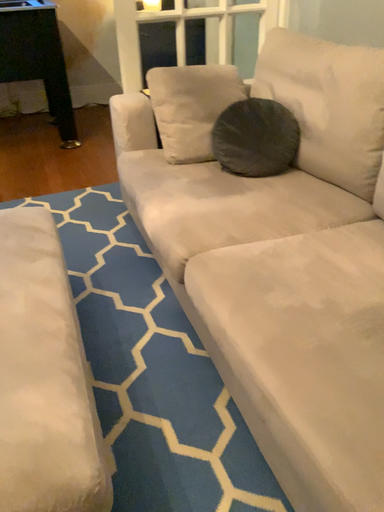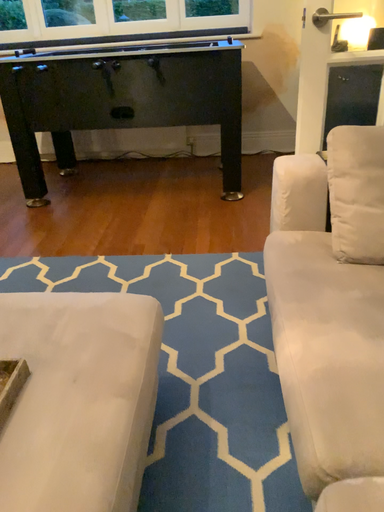
Question: Which way did the camera rotate in the video?

Choices:
 (A) rotated right
 (B) rotated left

Answer: (B)